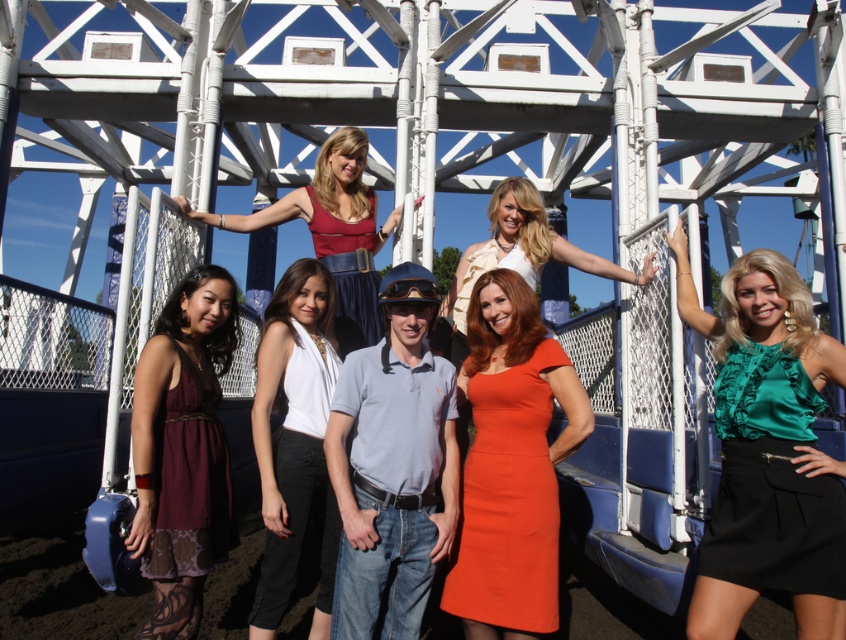
Based on the scene description, where is the light blue cotton polo shirt at center located in the image?

The light blue cotton polo shirt at center is located at point coordinates of 0.730 on the x axis and 0.465 on the y axis.

You are standing in front of the roller coaster structure and see the green satin dress at right and the white satin blouse at center. Which one is closer to you?

The green satin dress at right is closer to you because it is in front of the white satin blouse at center.